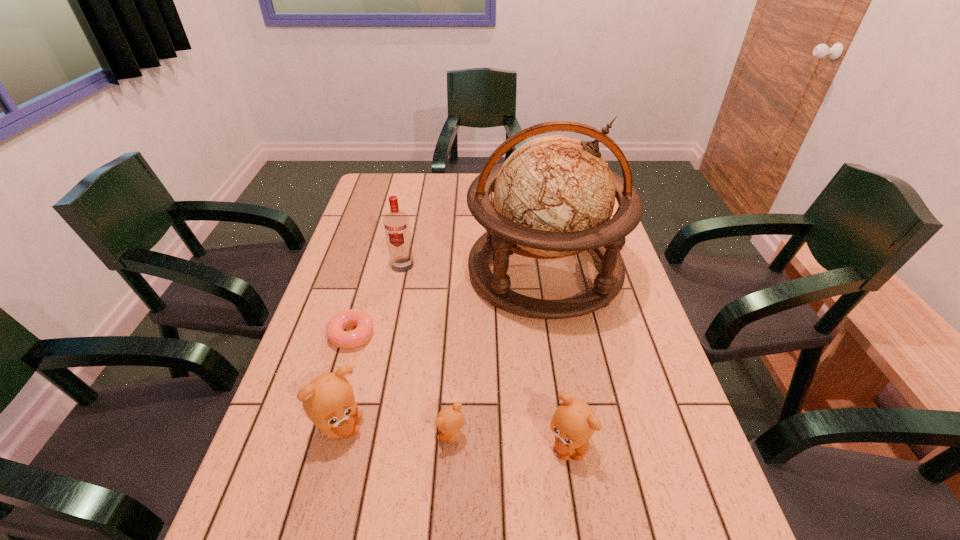
Observe the arrangement of all teddy bears in the image. To keep them evenly spaced, where would you place another teddy bear on the right? Please locate a free space. Please provide its 2D coordinates. Your answer should be formatted as a tuple, i.e. [(x, y)], where the tuple contains the x and y coordinates of a point satisfying the conditions above.

[(688, 454)]